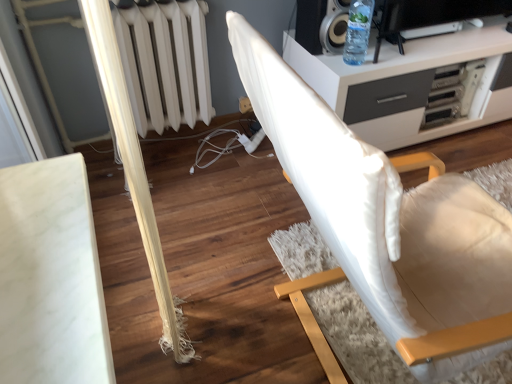
Question: Is white fabric chair at center a part of clear plastic bottle at upper right?

Choices:
 (A) no
 (B) yes

Answer: (A)

Question: From the image's perspective, would you say clear plastic bottle at upper right is shown under white fabric chair at center?

Choices:
 (A) yes
 (B) no

Answer: (B)

Question: From a real-world perspective, is clear plastic bottle at upper right physically above white fabric chair at center?

Choices:
 (A) yes
 (B) no

Answer: (A)

Question: Considering the relative positions of clear plastic bottle at upper right and white fabric chair at center in the image provided, is clear plastic bottle at upper right in front of white fabric chair at center?

Choices:
 (A) yes
 (B) no

Answer: (B)

Question: Is clear plastic bottle at upper right oriented away from white fabric chair at center?

Choices:
 (A) yes
 (B) no

Answer: (B)

Question: Does clear plastic bottle at upper right have a greater width compared to white fabric chair at center?

Choices:
 (A) no
 (B) yes

Answer: (A)

Question: From a real-world perspective, does white fabric chair at center sit lower than clear plastic bottle at upper right?

Choices:
 (A) yes
 (B) no

Answer: (A)

Question: Does white fabric chair at center have a smaller size compared to clear plastic bottle at upper right?

Choices:
 (A) no
 (B) yes

Answer: (A)

Question: Is white fabric chair at center to the right of clear plastic bottle at upper right from the viewer's perspective?

Choices:
 (A) no
 (B) yes

Answer: (A)

Question: Is white fabric chair at center positioned behind clear plastic bottle at upper right?

Choices:
 (A) yes
 (B) no

Answer: (B)

Question: Is white fabric chair at center turned away from clear plastic bottle at upper right?

Choices:
 (A) no
 (B) yes

Answer: (A)

Question: Is white fabric chair at center facing towards clear plastic bottle at upper right?

Choices:
 (A) no
 (B) yes

Answer: (A)

Question: From a real-world perspective, is white fabric chair at center physically located above or below clear plastic bottle at upper right?

Choices:
 (A) below
 (B) above

Answer: (A)